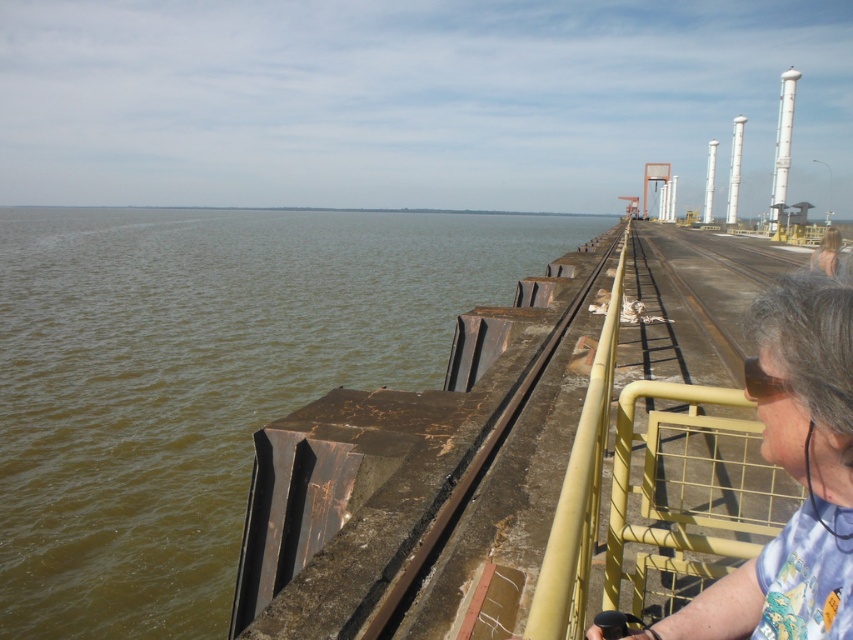
Question: Among these points, which one is farthest from the camera?

Choices:
 (A) (392, 604)
 (B) (675, 614)
 (C) (78, 472)

Answer: (C)

Question: Among these points, which one is farthest from the camera?

Choices:
 (A) (111, 428)
 (B) (579, 291)

Answer: (B)

Question: Can you confirm if brown water at center is smaller than gray hair at right?

Choices:
 (A) no
 (B) yes

Answer: (A)

Question: From the image, what is the correct spatial relationship of brown water at center in relation to yellow metal rail at center?

Choices:
 (A) right
 (B) left

Answer: (B)

Question: Estimate the real-world distances between objects in this image. Which object is farther from the brown water at center?

Choices:
 (A) yellow metal rail at center
 (B) gray hair at right

Answer: (B)

Question: Is brown water at center positioned in front of gray hair at right?

Choices:
 (A) no
 (B) yes

Answer: (A)